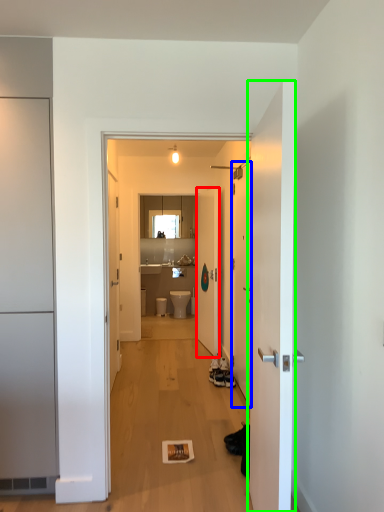
Question: Which is farther away from door (highlighted by a red box)? door (highlighted by a blue box) or door (highlighted by a green box)?

Choices:
 (A) door
 (B) door

Answer: (B)